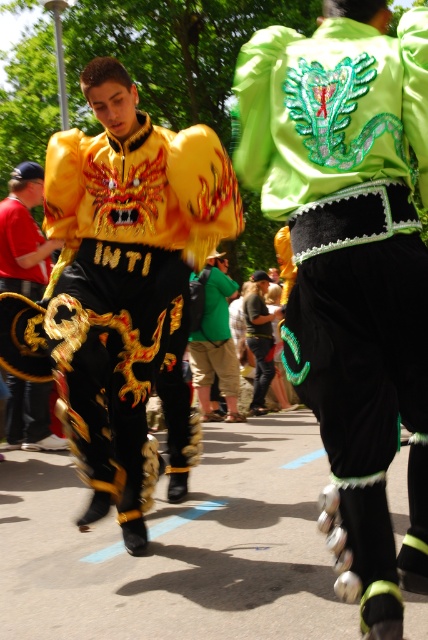
Question: Is gold embroidered jacket at center positioned behind green fabric backpack at center?

Choices:
 (A) yes
 (B) no

Answer: (B)

Question: Which object is the closest to the green fabric backpack at center?

Choices:
 (A) gold embroidered jacket at center
 (B) green satin jacket at center

Answer: (B)

Question: Can you confirm if green fabric backpack at center is smaller than green textured jacket at center?

Choices:
 (A) no
 (B) yes

Answer: (B)

Question: Which point appears farthest from the camera in this image?

Choices:
 (A) (262, 289)
 (B) (258, 316)

Answer: (A)

Question: Which object is closer to the camera taking this photo?

Choices:
 (A) green satin jacket at center
 (B) gold embroidered jacket at center
 (C) green sequined dragon at center
 (D) matte black dragon costume at left

Answer: (C)

Question: Observing the image, what is the correct spatial positioning of gold embroidered jacket at center in reference to green satin jacket at center?

Choices:
 (A) below
 (B) above

Answer: (B)